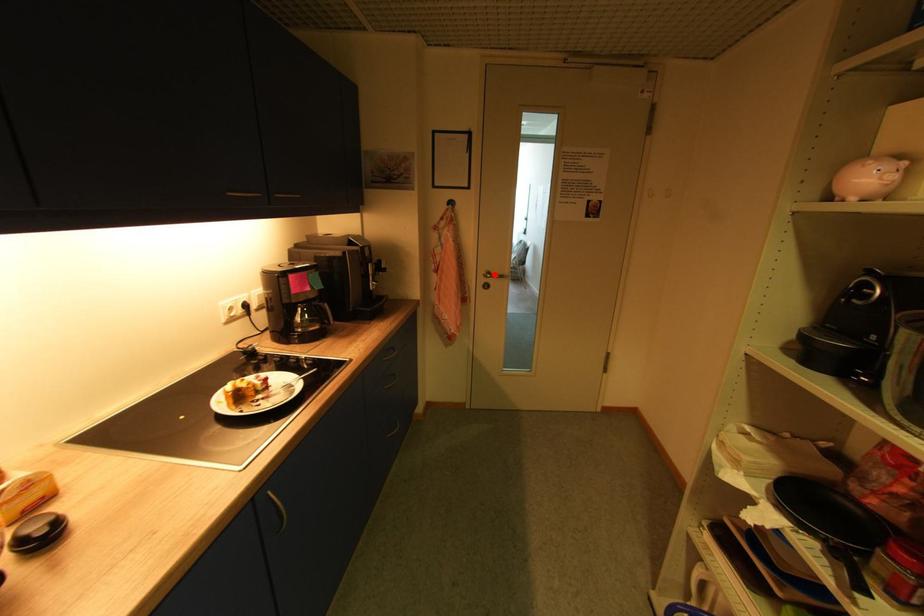
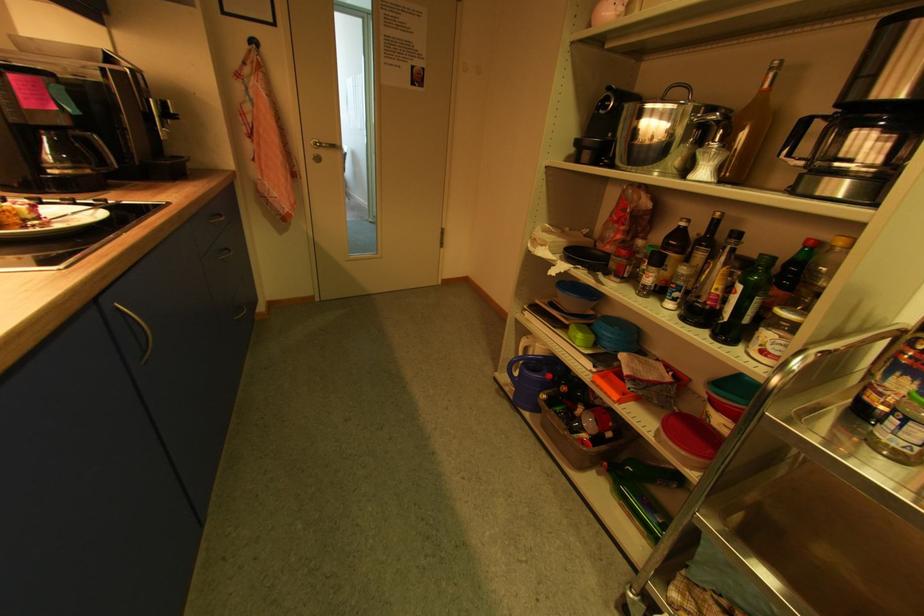
Question: I am providing you with two images of the same scene from different viewpoints. Image1 has a red point marked. In image2, the corresponding 3D location appears at what relative position? Reply with the corresponding letter.

Choices:
 (A) Closer
 (B) Farther

Answer: (A)